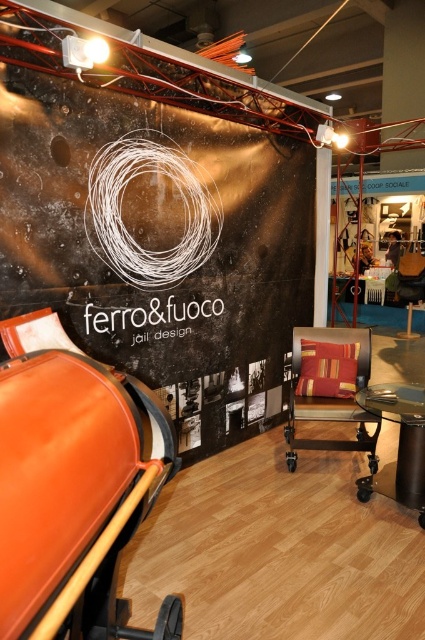
You are a visitor at the exhibition and want to sit on the textured beige swivel chair at center while placing your bag on the metallic glass table at lower right. Can you reach your bag without moving from the chair?

The distance between the textured beige swivel chair at center and the metallic glass table at lower right is 14.54 inches. Since this distance is relatively short, you can likely reach your bag without needing to move from the chair.

You are standing in the exhibition space and want to take a photo of the booth labeled ferrofuoco jail design. To get the best shot, you need to be exactly 10 feet away from the point at coordinates point (166, 204). Based on the information provided, are you currently at the correct distance?

The distance of point (166, 204) from the viewer is 10.13 feet, which is slightly more than 10 feet. Therefore, you are a bit too far away and need to move closer by approximately 0.13 feet to be exactly 10 feet away from the point.